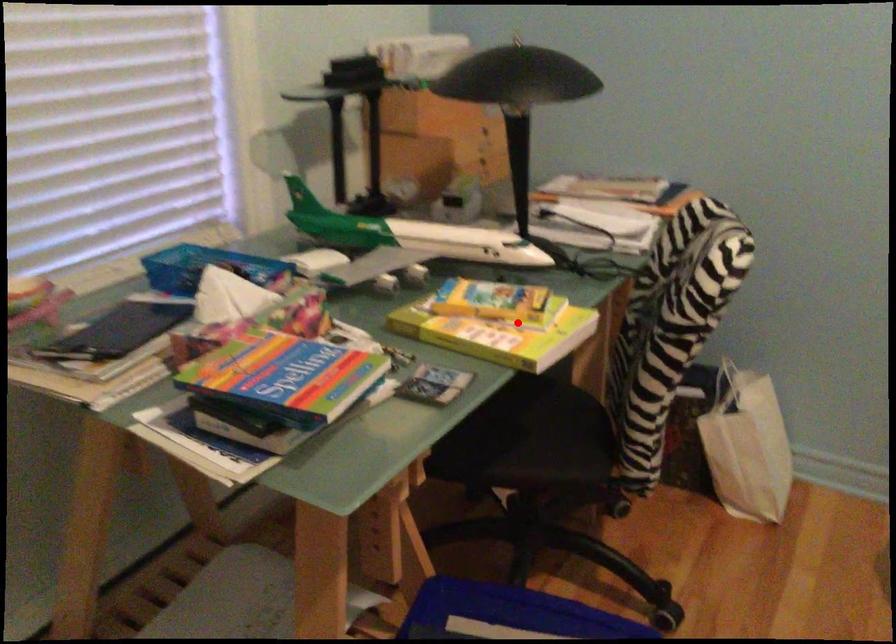
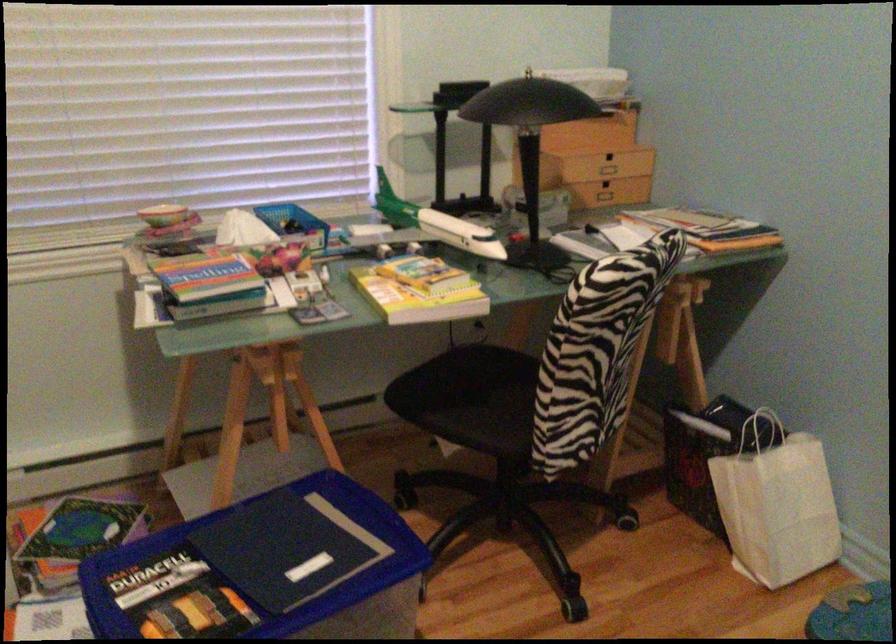
Question: I am providing you with two images of the same scene from different viewpoints. Image1 has a red point marked. In image2, the corresponding 3D location appears at what relative position? Reply with the corresponding letter.

Choices:
 (A) Closer
 (B) Farther

Answer: (B)